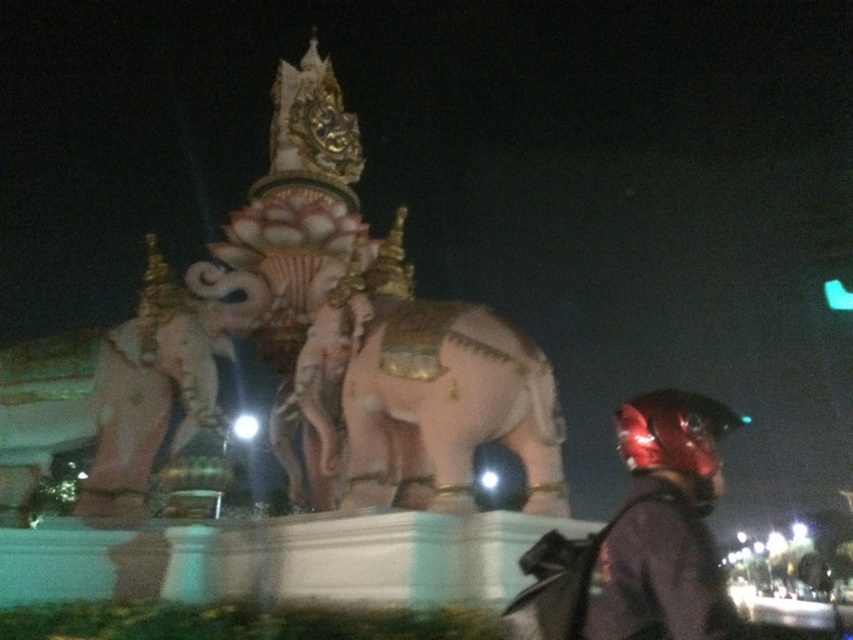
Question: Does smooth pinkish elephant at center come in front of shiny red helmet at lower right?

Choices:
 (A) no
 (B) yes

Answer: (A)

Question: Which of the following is the farthest from the observer?

Choices:
 (A) shiny red helmet at lower right
 (B) smooth pinkish elephant at center

Answer: (B)

Question: Can you confirm if smooth pinkish elephant at center is positioned above shiny red helmet at lower right?

Choices:
 (A) yes
 (B) no

Answer: (A)

Question: Is smooth pinkish elephant at center to the right of shiny red helmet at lower right from the viewer's perspective?

Choices:
 (A) yes
 (B) no

Answer: (B)

Question: Which point is closer to the camera?

Choices:
 (A) (648, 412)
 (B) (450, 467)

Answer: (A)